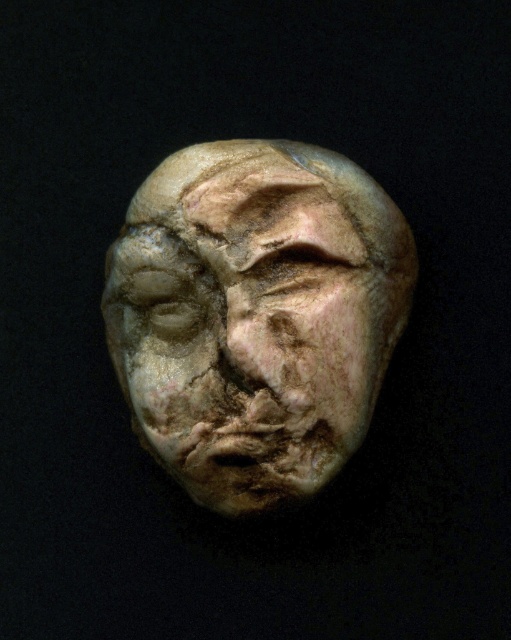
The height and width of the screenshot is (640, 511). I want to click on matte stone face at center, so click(256, 316).

From the picture: Is matte stone face at center shorter than matte stone forehead at upper center?

In fact, matte stone face at center may be taller than matte stone forehead at upper center.

Locate an element on the screen. matte stone face at center is located at coordinates (256, 316).